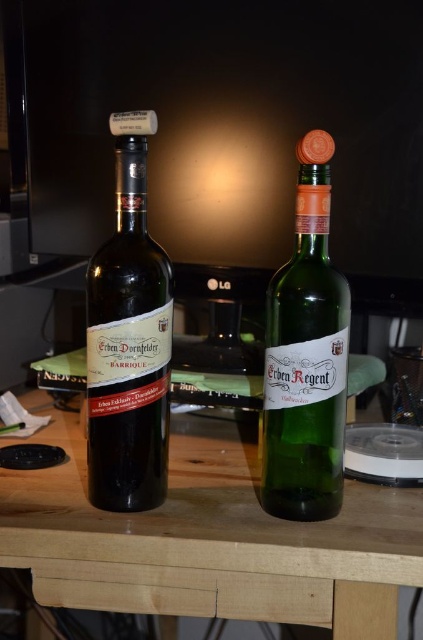
You are holding a smartphone that is 6 inches long. You want to take a photo of the wooden table at center from your current position. Can the smartphone fit horizontally in your frame to capture the entire table?

The wooden table at center is 19.34 inches away from the camera. Since the smartphone is 6 inches long, it can easily fit horizontally in the frame to capture the entire table as the distance allows for a wide enough view.

You are a wine sommelier standing in front of two wine bottles on a table. You need to reach for the point at (401, 496) first. Is this point behind or in front of the other point at (117, 372)?

The point at (401, 496) is behind the point at (117, 372).

You are organizing a wine tasting event and need to place the matte black bottle at left and the green glass bottle at center on a shelf. The shelf has a width limit of 25 cm. If the combined width of both bottles is 24 cm, will they fit together on the shelf?

The matte black bottle at left has a lesser width compared to the green glass bottle at center. Since their combined width is 24 cm, which is under the 25 cm limit, they will fit together on the shelf.